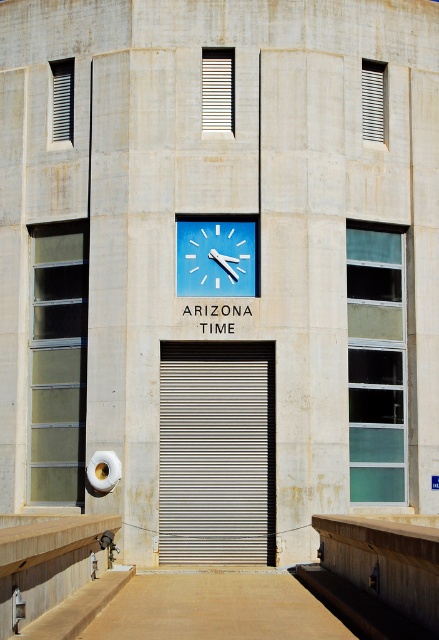
Is metallic silver garage door at center to the right of wooden at center from the viewer's perspective?

No, metallic silver garage door at center is not to the right of wooden at center.

Between point (186, 557) and point (345, 572), which one is positioned in front?

Point (345, 572) is more forward.

Is point (227, 368) closer to camera compared to point (330, 532)?

No, it is not.

Identify the location of metallic silver garage door at center. (216, 452).

Between point (231, 349) and point (238, 243), which one is positioned in front?

Positioned in front is point (231, 349).

This screenshot has height=640, width=439. Find the location of `metallic silver garage door at center`. metallic silver garage door at center is located at coordinates (216, 452).

Between point (211, 429) and point (212, 253), which one is positioned behind?

Positioned behind is point (212, 253).

What are the coordinates of `metallic silver garage door at center` in the screenshot? It's located at (216, 452).

Can you confirm if wooden at center is positioned above blue plastic clock at center?

No, wooden at center is not above blue plastic clock at center.

Who is taller, wooden at center or blue plastic clock at center?

With more height is wooden at center.

Between point (405, 556) and point (212, 227), which one is positioned in front?

Positioned in front is point (405, 556).

The width and height of the screenshot is (439, 640). I want to click on wooden at center, so coord(385,561).